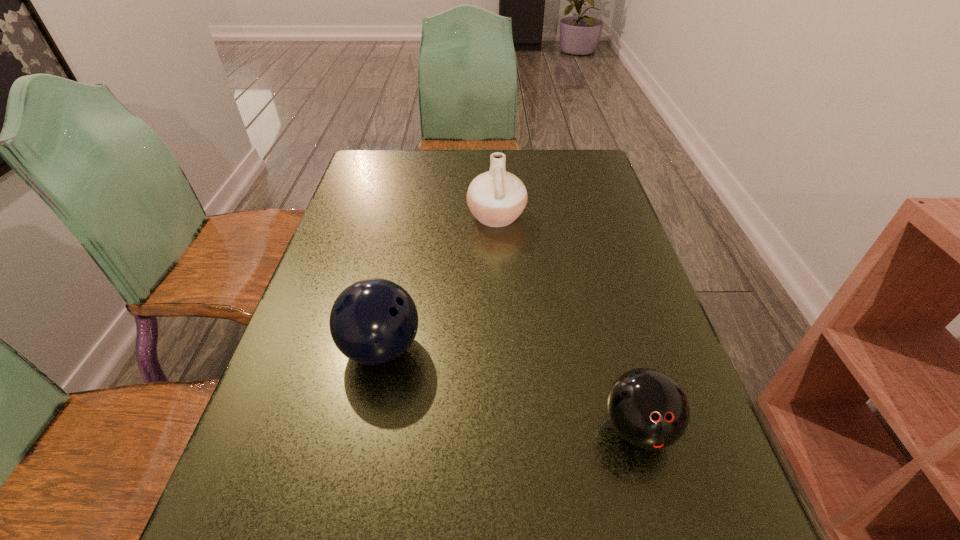
Image resolution: width=960 pixels, height=540 pixels. In order to click on free spot located 0.050m on the surface of the rightmost object near the finger holes in this screenshot , I will do `click(657, 496)`.

I want to click on object present at the left edge, so click(x=374, y=321).

The height and width of the screenshot is (540, 960). I want to click on object that is at the right edge, so click(647, 408).

Find the location of a particular element. free location at the left edge is located at coordinates (378, 211).

Identify the location of vacant area at the right edge. (606, 240).

Locate an element on the screen. This screenshot has width=960, height=540. vacant space at the far left corner is located at coordinates (389, 162).

Locate an element on the screen. vacant space at the far right corner of the desktop is located at coordinates (553, 149).

Image resolution: width=960 pixels, height=540 pixels. I want to click on empty space between the taller bowling ball and the shortest object, so tap(510, 388).

Locate an element on the screen. The height and width of the screenshot is (540, 960). free space between the leftmost object and the right bowling ball is located at coordinates point(510,388).

The height and width of the screenshot is (540, 960). I want to click on empty space that is in between the nearer bowling ball and the pottery, so click(x=567, y=322).